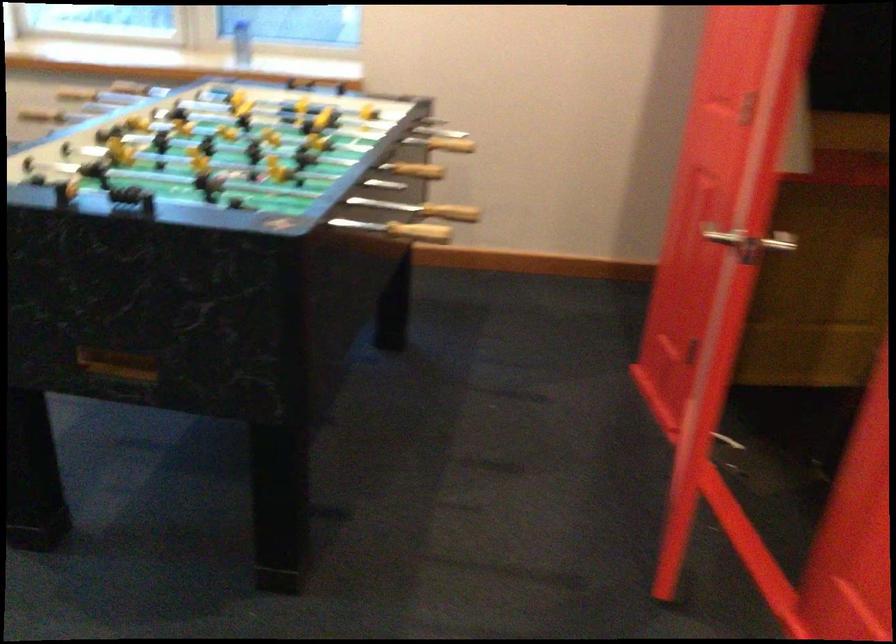
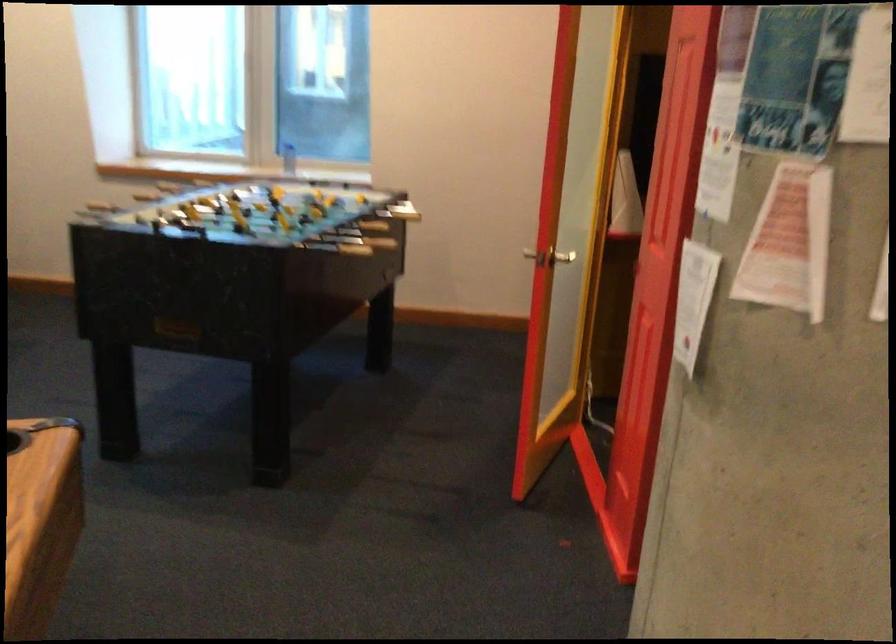
In the second image, find the point that corresponds to (769,251) in the first image.

(562, 257)